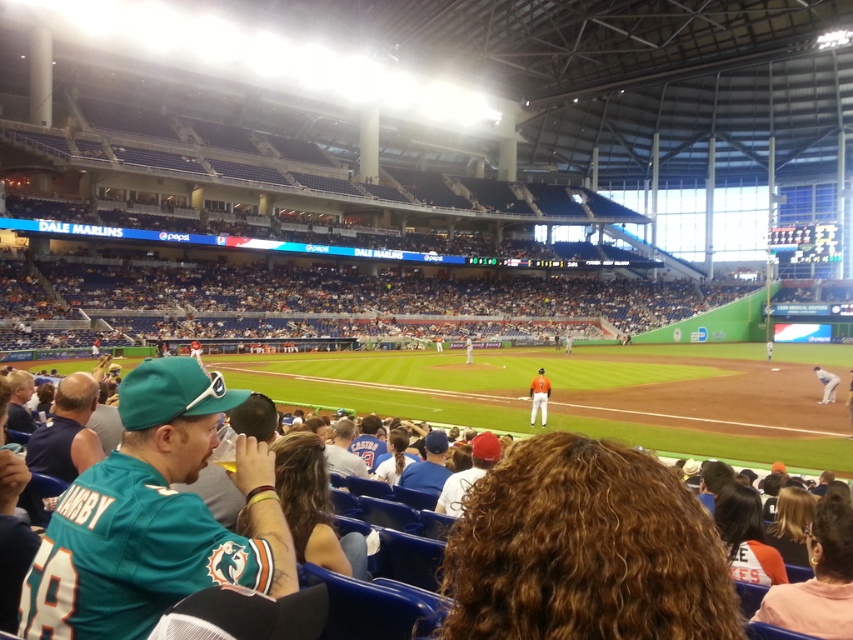
Question: Can you confirm if orange jersey at center is positioned to the left of white jersey at right?

Choices:
 (A) no
 (B) yes

Answer: (B)

Question: Does white jersey at right come behind white jersey at center?

Choices:
 (A) no
 (B) yes

Answer: (A)

Question: Which of the following is the farthest from the observer?

Choices:
 (A) white jersey at center
 (B) orange jersey at center
 (C) white jersey at right

Answer: (A)

Question: Can you confirm if orange jersey at center is smaller than white jersey at center?

Choices:
 (A) no
 (B) yes

Answer: (B)

Question: Which object is positioned closest to the orange jersey at center?

Choices:
 (A) white jersey at right
 (B) white jersey at center

Answer: (A)

Question: Which object appears farthest from the camera in this image?

Choices:
 (A) white jersey at center
 (B) orange jersey at center
 (C) white jersey at right

Answer: (A)